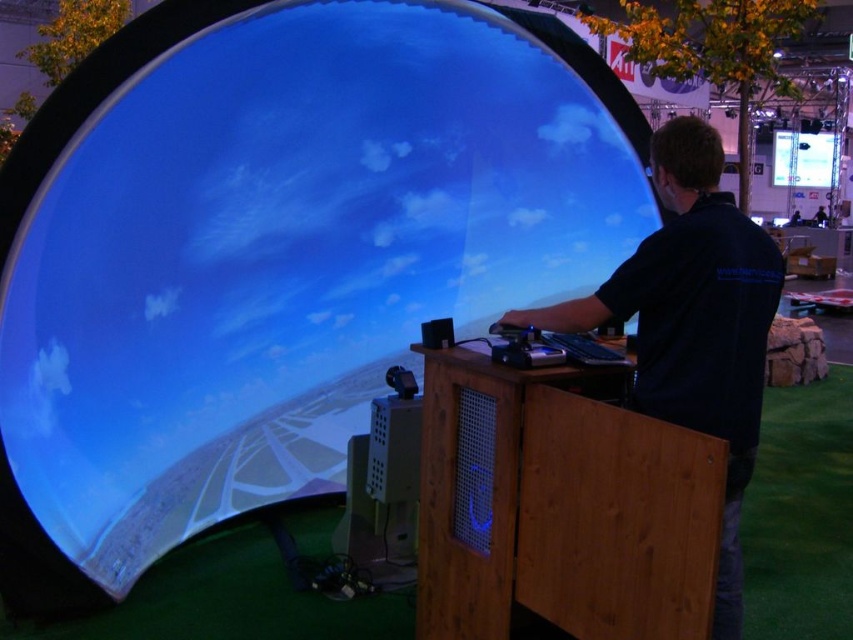
Which of these two, wooden table at center or dark blue shirt at center, stands taller?

dark blue shirt at center is taller.

Is point (563, 518) in front of point (750, 452)?

Yes, it is.

The width and height of the screenshot is (853, 640). Identify the location of wooden table at center. (560, 506).

You are a GUI agent. You are given a task and a screenshot of the screen. Output one action in this format:
    pyautogui.click(x=<x>, y=<y>)
    Task: Click on the wooden table at center
    The image size is (853, 640).
    Given the screenshot: What is the action you would take?
    pyautogui.click(x=560, y=506)